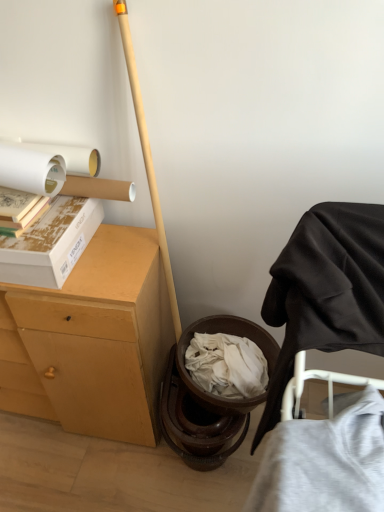
In order to click on vacant area that lies to the right of white cardboard box at upper left in this screenshot , I will do `click(119, 260)`.